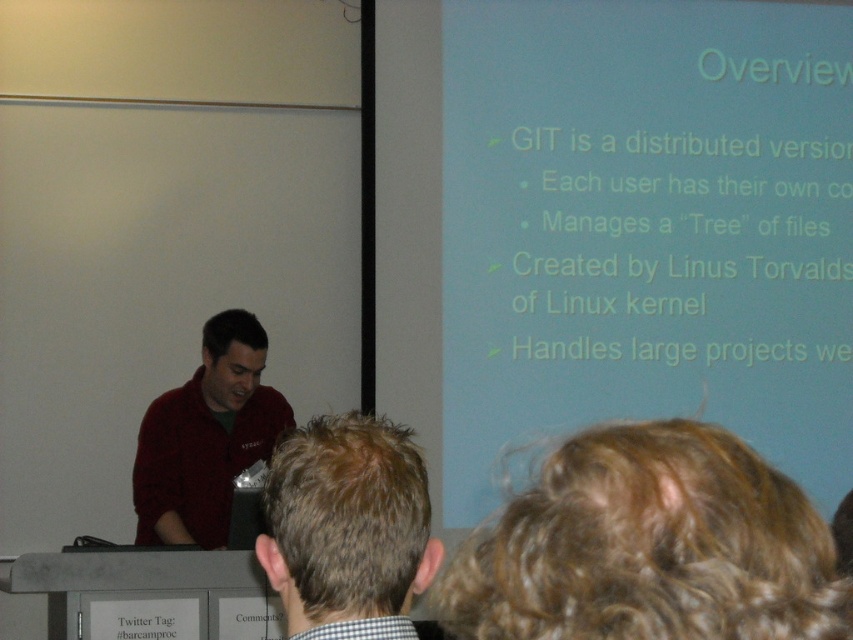
Is point (352, 484) positioned before point (178, 465)?

Yes.

Can you confirm if brown hair at center is positioned to the left of matte red sweater at left?

In fact, brown hair at center is to the right of matte red sweater at left.

The width and height of the screenshot is (853, 640). Find the location of `brown hair at center`. brown hair at center is located at coordinates (347, 529).